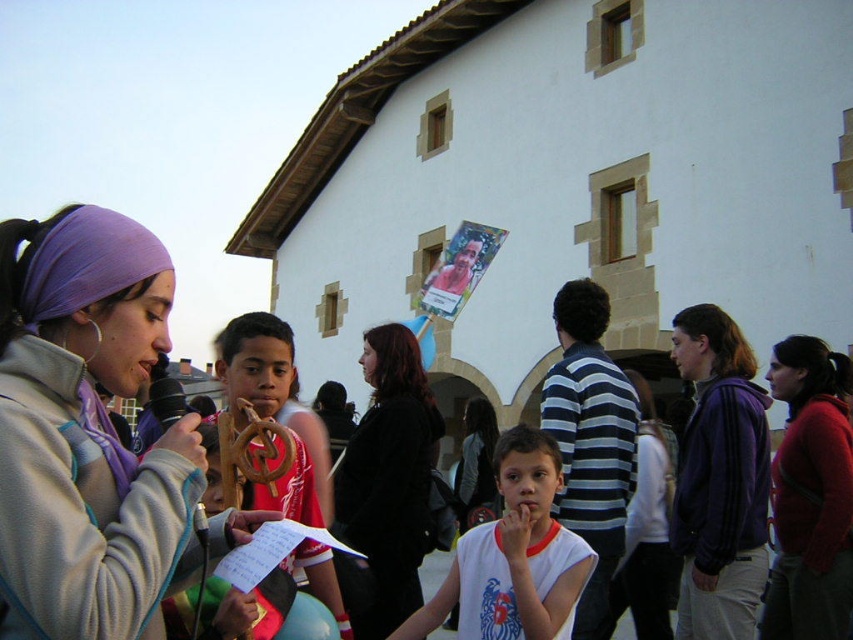
Question: Which object appears farthest from the camera in this image?

Choices:
 (A) black matte jacket at center
 (B) red sweater at center

Answer: (A)

Question: Is white matte shirt at center to the right of purple fabric headscarf at upper left from the viewer's perspective?

Choices:
 (A) no
 (B) yes

Answer: (B)

Question: Which point is closer to the camera taking this photo?

Choices:
 (A) (444, 300)
 (B) (88, 472)

Answer: (B)

Question: Which point is closer to the camera?

Choices:
 (A) matte paper poster at center
 (B) matte black jacket at center
 (C) purple fabric headband at upper left
 (D) red sweater at center

Answer: (C)

Question: Does black matte jacket at center appear on the left side of matte black jacket at center?

Choices:
 (A) yes
 (B) no

Answer: (A)

Question: Is white matte shirt at center below purple fabric headscarf at upper left?

Choices:
 (A) no
 (B) yes

Answer: (B)